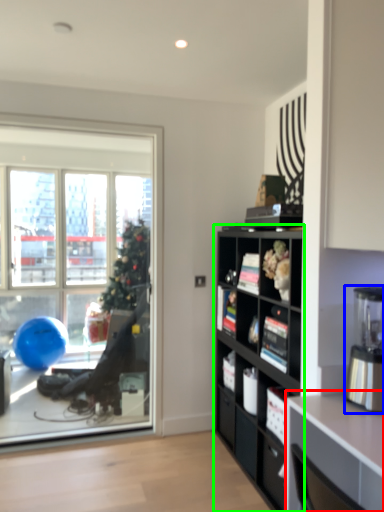
Question: Estimate the real-world distances between objects in this image. Which object is closer to desk (highlighted by a red box), coffee machine (highlighted by a blue box) or cabinetry (highlighted by a green box)?

Choices:
 (A) coffee machine
 (B) cabinetry

Answer: (A)